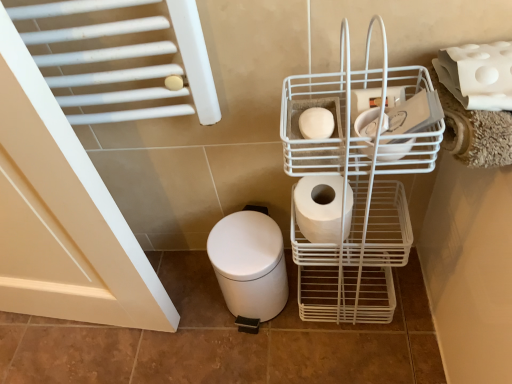
This screenshot has width=512, height=384. Find the location of `vacant region below white wire basket at center right (from a real-world perspective)`. vacant region below white wire basket at center right (from a real-world perspective) is located at coordinates (336, 299).